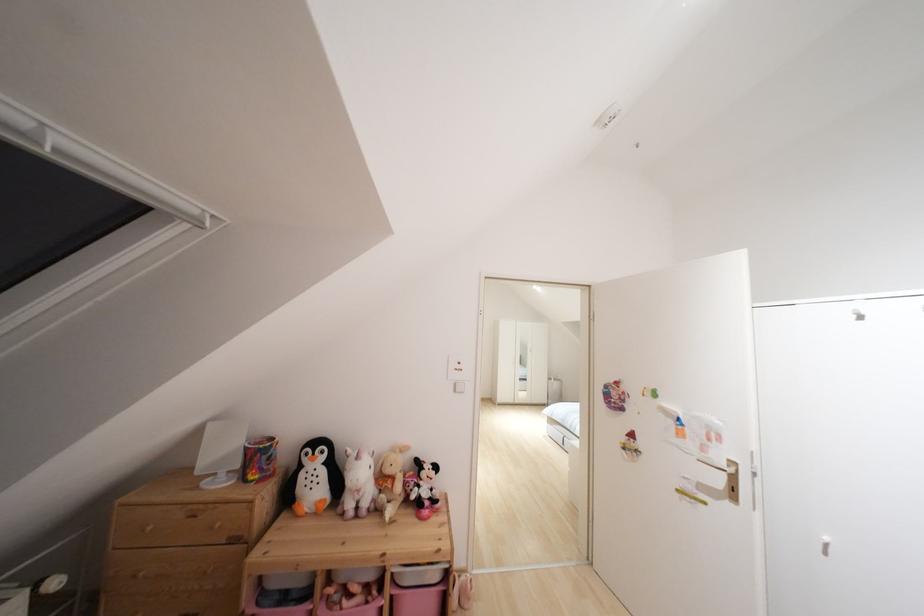
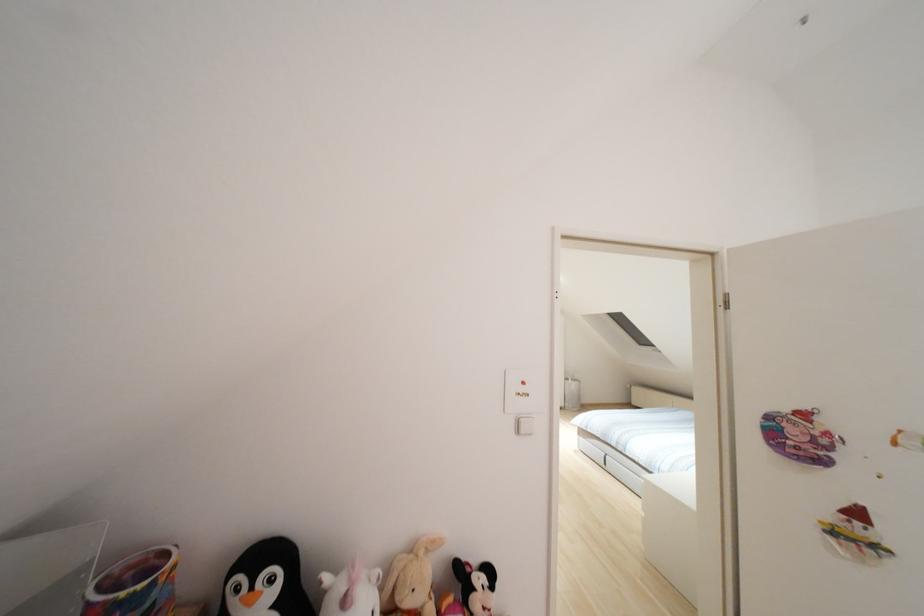
Locate, in the second image, the point that corresponds to (x=322, y=451) in the first image.

(272, 578)